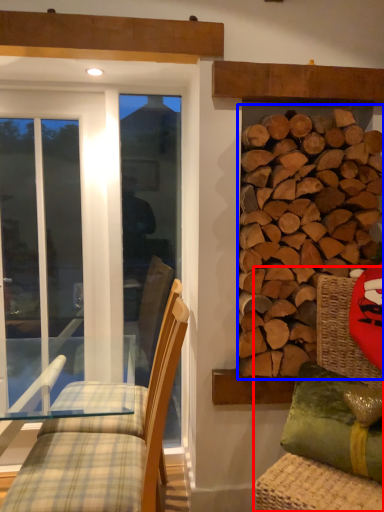
Question: Which point is closer to the camera, swivel chair (highlighted by a red box) or hardwood (highlighted by a blue box)?

Choices:
 (A) swivel chair
 (B) hardwood

Answer: (A)